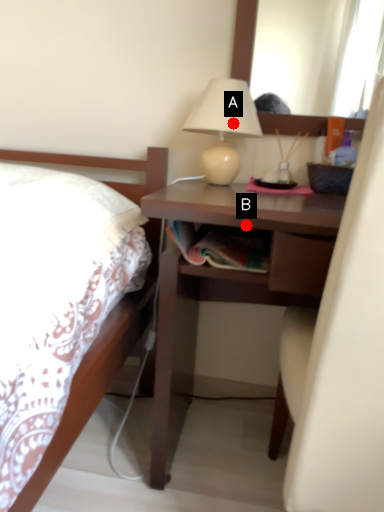
Question: Two points are circled on the image, labeled by A and B beside each circle. Which point is closer to the camera taking this photo?

Choices:
 (A) A is closer
 (B) B is closer

Answer: (B)